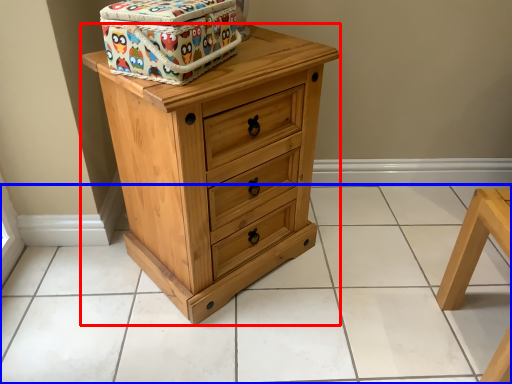
Question: Among these objects, which one is nearest to the camera, chest of drawers (highlighted by a red box) or tile (highlighted by a blue box)?

Choices:
 (A) chest of drawers
 (B) tile

Answer: (A)